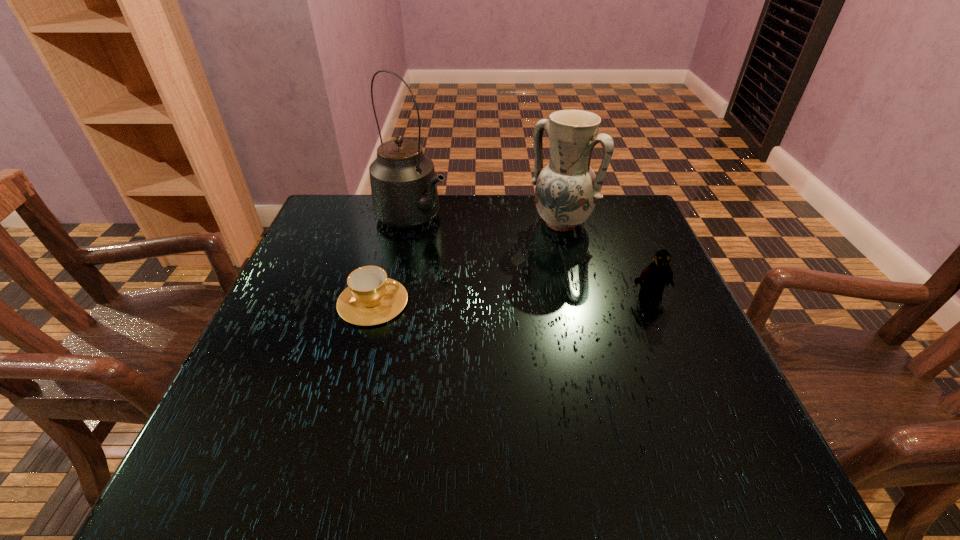
Locate an element on the screen. The image size is (960, 540). vacant space on the desktop that is between the shortest object and the second shortest object and is positioned on either side of the pottery is located at coordinates (490, 300).

Locate an element on the screen. free space on the desktop that is between the cup and the Lego and is positioned spout on the tallest object is located at coordinates (544, 299).